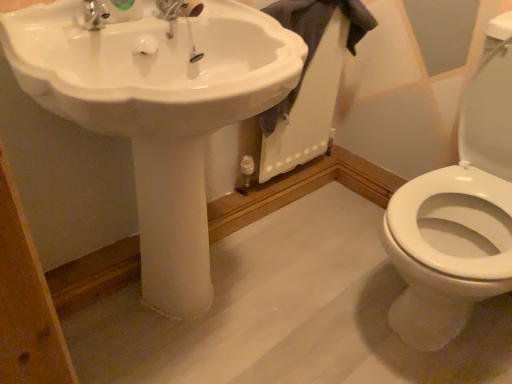
The height and width of the screenshot is (384, 512). Find the location of `free spot to the right of white glossy sink at center`. free spot to the right of white glossy sink at center is located at coordinates (312, 295).